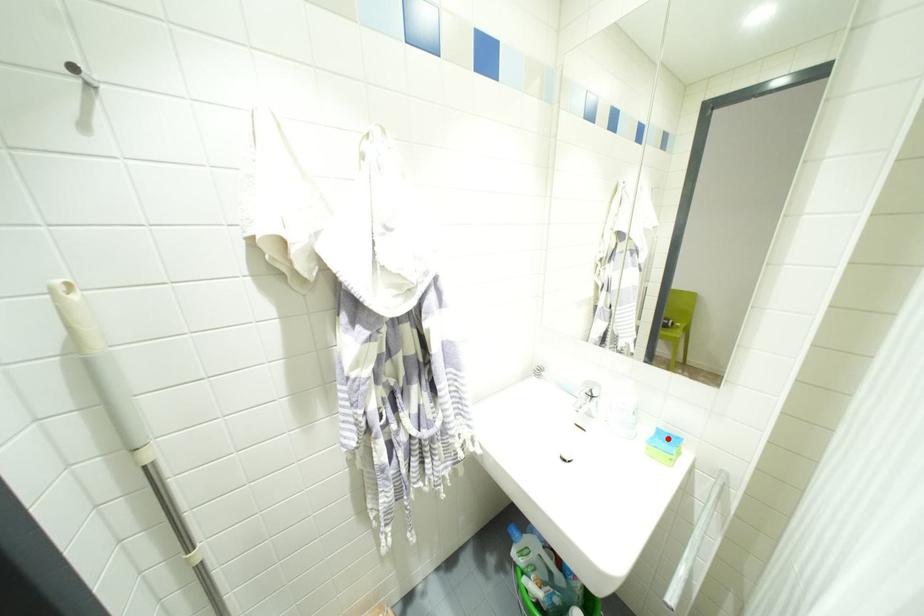
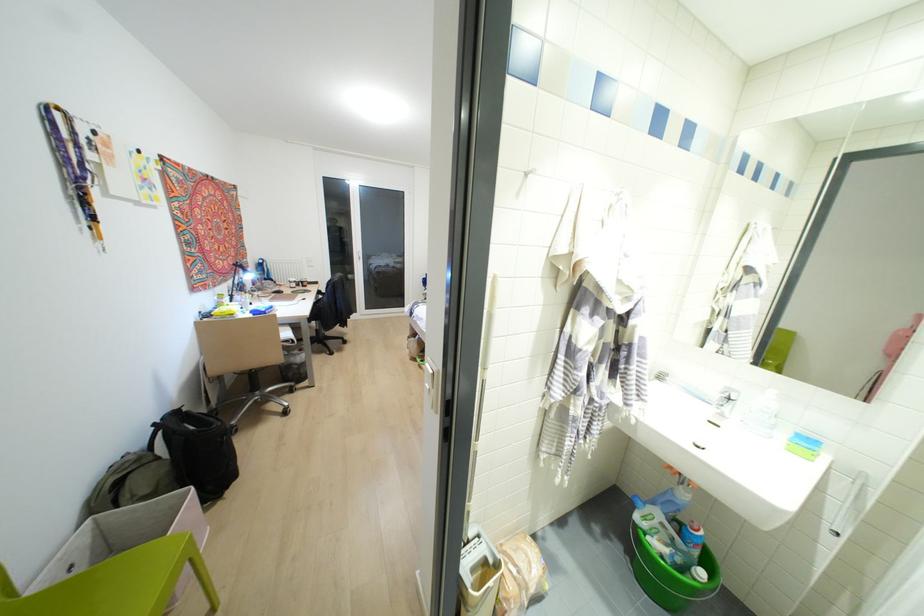
In the second image, find the point that corresponds to the highlighted location in the first image.

(807, 440)